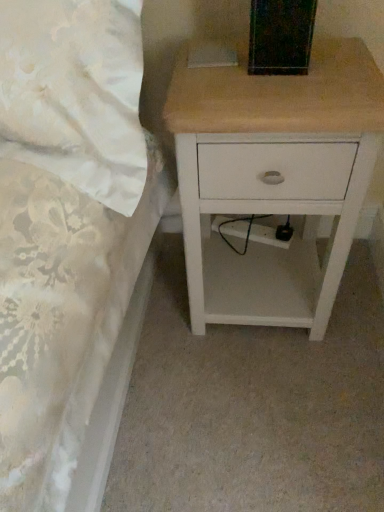
Question: Is white wood nightstand at upper right at the left side of white fabric bed at upper left?

Choices:
 (A) yes
 (B) no

Answer: (B)

Question: Is white wood nightstand at upper right further to the viewer compared to white fabric bed at upper left?

Choices:
 (A) no
 (B) yes

Answer: (B)

Question: From a real-world perspective, is white wood nightstand at upper right positioned under white fabric bed at upper left based on gravity?

Choices:
 (A) yes
 (B) no

Answer: (A)

Question: From the image's perspective, would you say white wood nightstand at upper right is shown under white fabric bed at upper left?

Choices:
 (A) yes
 (B) no

Answer: (A)

Question: Could you tell me if white wood nightstand at upper right is turned towards white fabric bed at upper left?

Choices:
 (A) yes
 (B) no

Answer: (B)

Question: From a real-world perspective, is white wood nightstand at upper right located higher than white fabric bed at upper left?

Choices:
 (A) yes
 (B) no

Answer: (B)

Question: Considering the relative sizes of white fabric bed at upper left and white wood nightstand at upper right in the image provided, is white fabric bed at upper left bigger than white wood nightstand at upper right?

Choices:
 (A) yes
 (B) no

Answer: (A)

Question: From the image's perspective, is white fabric bed at upper left located beneath white wood nightstand at upper right?

Choices:
 (A) no
 (B) yes

Answer: (A)

Question: From a real-world perspective, is white fabric bed at upper left beneath white wood nightstand at upper right?

Choices:
 (A) yes
 (B) no

Answer: (B)

Question: Can you see white fabric bed at upper left touching white wood nightstand at upper right?

Choices:
 (A) yes
 (B) no

Answer: (B)

Question: Considering the relative sizes of white fabric bed at upper left and white wood nightstand at upper right in the image provided, is white fabric bed at upper left smaller than white wood nightstand at upper right?

Choices:
 (A) no
 (B) yes

Answer: (A)

Question: Can you confirm if white fabric bed at upper left is wider than white wood nightstand at upper right?

Choices:
 (A) yes
 (B) no

Answer: (B)

Question: Based on their sizes in the image, would you say white fabric bed at upper left is bigger or smaller than white wood nightstand at upper right?

Choices:
 (A) big
 (B) small

Answer: (A)